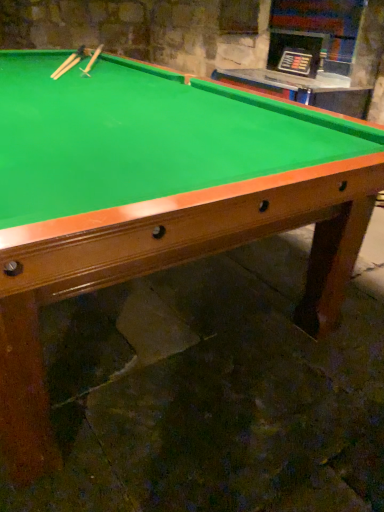
The image size is (384, 512). I want to click on wooden cue at upper left, which is the first cue in left-to-right order, so (71, 62).

Describe the element at coordinates (71, 62) in the screenshot. I see `wooden cue at upper left, the second cue positioned from the right` at that location.

What do you see at coordinates (93, 60) in the screenshot?
I see `wooden cue at upper left, placed as the first cue when sorted from right to left` at bounding box center [93, 60].

Where is `wooden cue at upper left, which is the second cue from left to right`? This screenshot has width=384, height=512. wooden cue at upper left, which is the second cue from left to right is located at coordinates (93, 60).

At what (x,y) coordinates should I click in order to perform the action: click on wooden cue at upper left, which is the first cue in left-to-right order. Please return your answer as a coordinate pair (x, y). This screenshot has width=384, height=512. Looking at the image, I should click on [71, 62].

Between wooden cue at upper left, which is the second cue from left to right, and wooden cue at upper left, the second cue positioned from the right, which one appears on the right side from the viewer's perspective?

From the viewer's perspective, wooden cue at upper left, which is the second cue from left to right, appears more on the right side.

Between wooden cue at upper left, placed as the first cue when sorted from right to left, and wooden cue at upper left, the second cue positioned from the right, which one is positioned behind?

Positioned behind is wooden cue at upper left, placed as the first cue when sorted from right to left.

Is point (102, 46) positioned in front of point (66, 59)?

No, it is not.

Based on the photo, from the image's perspective, which object appears higher, wooden cue at upper left, which is the second cue from left to right, or wooden cue at upper left, the second cue positioned from the right?

From the image's view, wooden cue at upper left, which is the second cue from left to right, is above.

From a real-world perspective, between wooden cue at upper left, which is the second cue from left to right, and wooden cue at upper left, the second cue positioned from the right, who is vertically lower?

wooden cue at upper left, the second cue positioned from the right, from a real-world perspective.

Does wooden cue at upper left, placed as the first cue when sorted from right to left, have a greater width compared to wooden cue at upper left, which is the first cue in left-to-right order?

Correct, the width of wooden cue at upper left, placed as the first cue when sorted from right to left, exceeds that of wooden cue at upper left, which is the first cue in left-to-right order.

Considering the sizes of objects wooden cue at upper left, placed as the first cue when sorted from right to left, and wooden cue at upper left, the second cue positioned from the right, in the image provided, who is taller, wooden cue at upper left, placed as the first cue when sorted from right to left, or wooden cue at upper left, the second cue positioned from the right,?

wooden cue at upper left, placed as the first cue when sorted from right to left, is taller.

Considering the sizes of objects wooden cue at upper left, which is the second cue from left to right, and wooden cue at upper left, which is the first cue in left-to-right order, in the image provided, who is smaller, wooden cue at upper left, which is the second cue from left to right, or wooden cue at upper left, which is the first cue in left-to-right order,?

With smaller size is wooden cue at upper left, which is the first cue in left-to-right order.

Would you say wooden cue at upper left, which is the second cue from left to right, is inside or outside wooden cue at upper left, the second cue positioned from the right?

wooden cue at upper left, which is the second cue from left to right, lies outside wooden cue at upper left, the second cue positioned from the right.

Is there a large distance between wooden cue at upper left, placed as the first cue when sorted from right to left, and wooden cue at upper left, which is the first cue in left-to-right order?

That's not correct — wooden cue at upper left, placed as the first cue when sorted from right to left, is a little close to wooden cue at upper left, which is the first cue in left-to-right order.

Does wooden cue at upper left, placed as the first cue when sorted from right to left, turn towards wooden cue at upper left, the second cue positioned from the right?

No, wooden cue at upper left, placed as the first cue when sorted from right to left, does not turn towards wooden cue at upper left, the second cue positioned from the right.

The image size is (384, 512). Find the location of `cue located above the wooden cue at upper left, the second cue positioned from the right (from a real-world perspective)`. cue located above the wooden cue at upper left, the second cue positioned from the right (from a real-world perspective) is located at coordinates (93, 60).

Which is more to the left, wooden cue at upper left, the second cue positioned from the right, or wooden cue at upper left, placed as the first cue when sorted from right to left?

wooden cue at upper left, the second cue positioned from the right.

Looking at this image, is wooden cue at upper left, which is the first cue in left-to-right order, closer to the viewer compared to wooden cue at upper left, placed as the first cue when sorted from right to left?

That is True.

Does point (80, 56) lie in front of point (96, 52)?

Yes.

From the image's perspective, is wooden cue at upper left, which is the first cue in left-to-right order, on wooden cue at upper left, placed as the first cue when sorted from right to left?

No, from the image's perspective, wooden cue at upper left, which is the first cue in left-to-right order, is not above wooden cue at upper left, placed as the first cue when sorted from right to left.

From a real-world perspective, is wooden cue at upper left, which is the first cue in left-to-right order, physically located above or below wooden cue at upper left, which is the second cue from left to right?

wooden cue at upper left, which is the first cue in left-to-right order, is below wooden cue at upper left, which is the second cue from left to right.

Looking at their sizes, would you say wooden cue at upper left, the second cue positioned from the right, is wider or thinner than wooden cue at upper left, which is the second cue from left to right?

wooden cue at upper left, the second cue positioned from the right, is thinner than wooden cue at upper left, which is the second cue from left to right.

Can you confirm if wooden cue at upper left, the second cue positioned from the right, is shorter than wooden cue at upper left, placed as the first cue when sorted from right to left?

Yes, wooden cue at upper left, the second cue positioned from the right, is shorter than wooden cue at upper left, placed as the first cue when sorted from right to left.

Is wooden cue at upper left, the second cue positioned from the right, bigger than wooden cue at upper left, placed as the first cue when sorted from right to left?

No.

Is wooden cue at upper left, which is the first cue in left-to-right order, spatially inside wooden cue at upper left, placed as the first cue when sorted from right to left, or outside of it?

wooden cue at upper left, which is the first cue in left-to-right order, is spatially situated outside wooden cue at upper left, placed as the first cue when sorted from right to left.

Is there a large distance between wooden cue at upper left, which is the first cue in left-to-right order, and wooden cue at upper left, which is the second cue from left to right?

wooden cue at upper left, which is the first cue in left-to-right order, is actually quite close to wooden cue at upper left, which is the second cue from left to right.

Is wooden cue at upper left, which is the first cue in left-to-right order, aimed at wooden cue at upper left, which is the second cue from left to right?

No, wooden cue at upper left, which is the first cue in left-to-right order, is not oriented towards wooden cue at upper left, which is the second cue from left to right.

What's the angular difference between wooden cue at upper left, which is the first cue in left-to-right order, and wooden cue at upper left, placed as the first cue when sorted from right to left,'s facing directions?

There is a 2.21-degree angle between the facing directions of wooden cue at upper left, which is the first cue in left-to-right order, and wooden cue at upper left, placed as the first cue when sorted from right to left.

How far apart are wooden cue at upper left, the second cue positioned from the right, and wooden cue at upper left, which is the second cue from left to right?

The distance of wooden cue at upper left, the second cue positioned from the right, from wooden cue at upper left, which is the second cue from left to right, is 7.89 inches.

In order to click on cue below the wooden cue at upper left, placed as the first cue when sorted from right to left (from a real-world perspective) in this screenshot , I will do [x=71, y=62].

Image resolution: width=384 pixels, height=512 pixels. Find the location of `cue on the right of wooden cue at upper left, which is the first cue in left-to-right order`. cue on the right of wooden cue at upper left, which is the first cue in left-to-right order is located at coordinates (93, 60).

You are a GUI agent. You are given a task and a screenshot of the screen. Output one action in this format:
    pyautogui.click(x=<x>, y=<y>)
    Task: Click on the cue located behind the wooden cue at upper left, which is the first cue in left-to-right order
    The width and height of the screenshot is (384, 512).
    Given the screenshot: What is the action you would take?
    pyautogui.click(x=93, y=60)